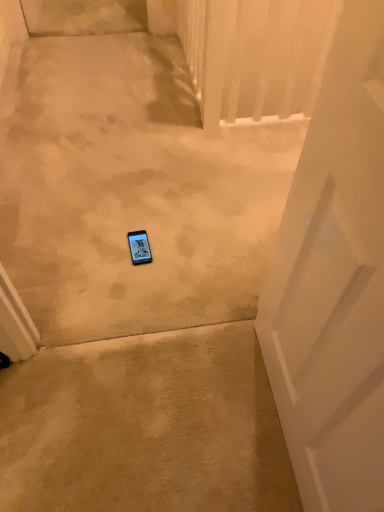
This screenshot has width=384, height=512. What are the coordinates of `free location to the left of matte black phone at center` in the screenshot? It's located at (97, 247).